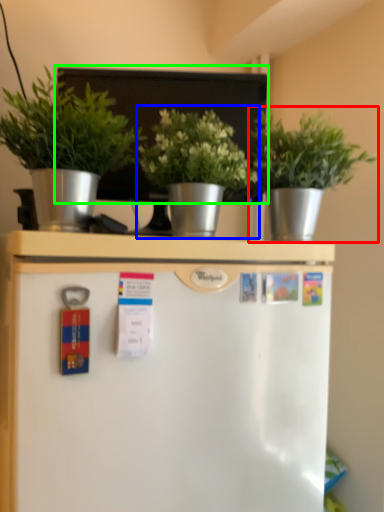
Question: Which object is the farthest from houseplant (highlighted by a red box)? Choose among these: houseplant (highlighted by a blue box) or bulletin board (highlighted by a green box).

Choices:
 (A) houseplant
 (B) bulletin board

Answer: (B)